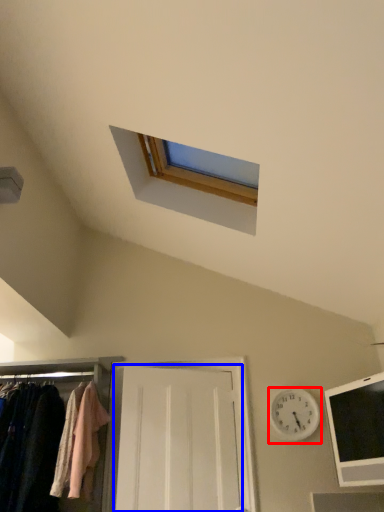
Question: Among these objects, which one is farthest to the camera, clock (highlighted by a red box) or door (highlighted by a blue box)?

Choices:
 (A) clock
 (B) door

Answer: (A)